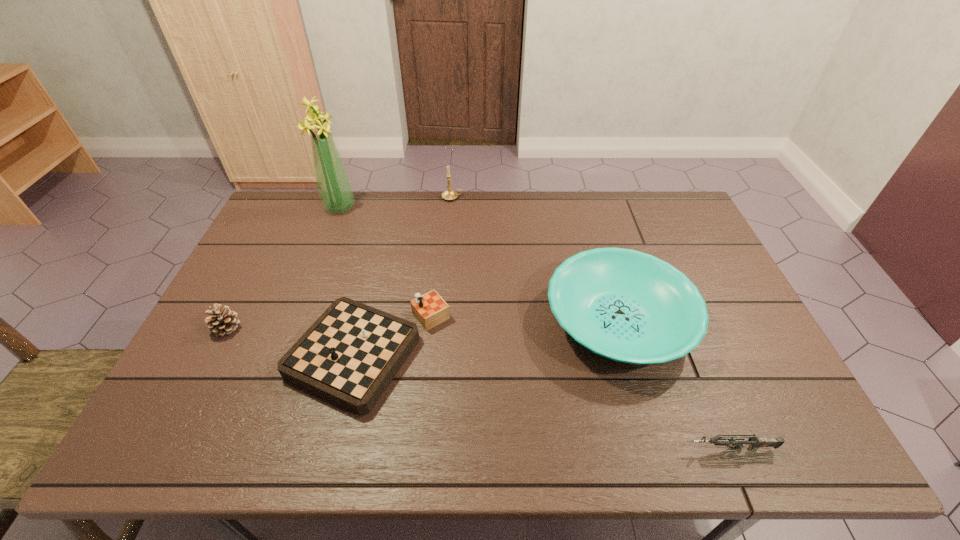
Where is `vacant point located on the back of the leftmost object`? This screenshot has width=960, height=540. vacant point located on the back of the leftmost object is located at coordinates (257, 270).

Locate an element on the screen. The width and height of the screenshot is (960, 540). vacant region located on the right of the chessboard is located at coordinates (540, 353).

Locate an element on the screen. The width and height of the screenshot is (960, 540). free space located aimed along the barrel of the shortest object is located at coordinates (660, 449).

Locate an element on the screen. This screenshot has height=540, width=960. free region located aimed along the barrel of the shortest object is located at coordinates (628, 449).

Image resolution: width=960 pixels, height=540 pixels. I want to click on free space located 0.400m aimed along the barrel of the shortest object, so click(x=500, y=449).

The width and height of the screenshot is (960, 540). What are the coordinates of `bouquet that is positioned at the far edge` in the screenshot? It's located at (334, 187).

Image resolution: width=960 pixels, height=540 pixels. Find the location of `candle holder that is at the far edge`. candle holder that is at the far edge is located at coordinates (449, 194).

Locate an element on the screen. object located in the near edge section of the desktop is located at coordinates (755, 442).

Locate an element on the screen. The width and height of the screenshot is (960, 540). object that is at the left edge is located at coordinates pos(222,321).

Locate an element on the screen. This screenshot has width=960, height=540. dish located in the right edge section of the desktop is located at coordinates (628, 306).